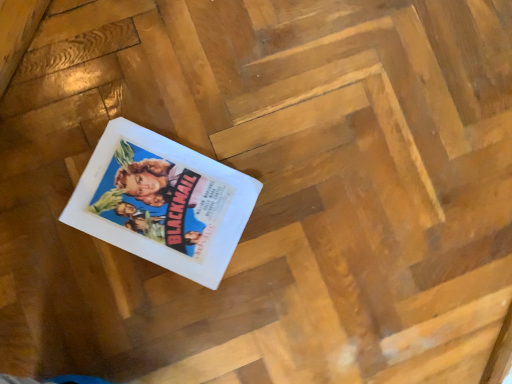
At what (x,y) coordinates should I click in order to perform the action: click on vacant space to the left of white paper at center. Please return your answer as a coordinate pair (x, y). Looking at the image, I should click on (81, 114).